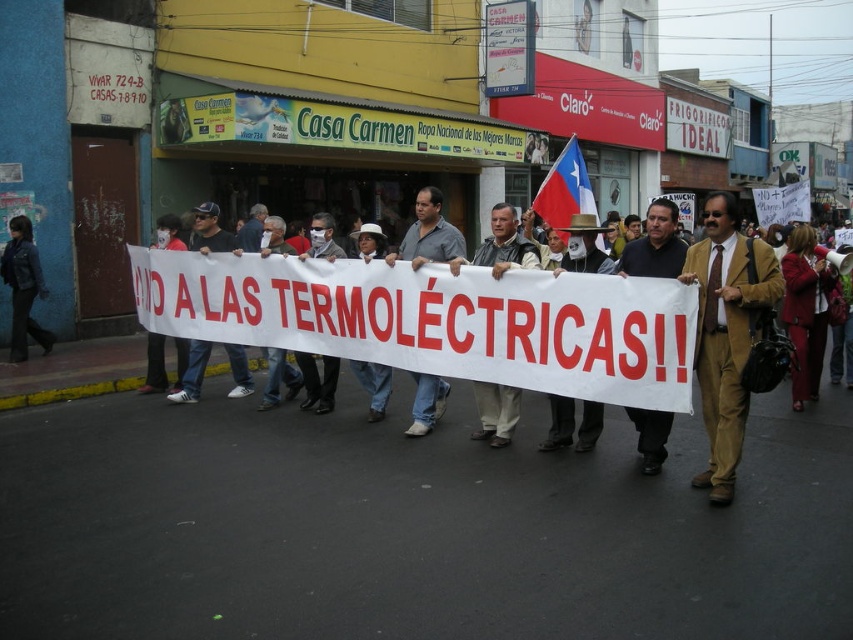
Question: Does khaki cotton pants at center have a smaller size compared to white cotton shirt at center?

Choices:
 (A) no
 (B) yes

Answer: (B)

Question: Estimate the real-world distances between objects in this image. Which object is closer to the brown leather jacket at center?

Choices:
 (A) dark blue leather jacket at left
 (B) dark brown suit at center
 (C) blue and white fabric flag at center

Answer: (B)

Question: Which of the following is the closest to the observer?

Choices:
 (A) (648, 420)
 (B) (320, 227)

Answer: (A)

Question: Does dark brown suit at center appear under gray cotton shirt at center?

Choices:
 (A) no
 (B) yes

Answer: (B)

Question: In this image, where is brown leather jacket at center located relative to blue and white fabric flag at center?

Choices:
 (A) left
 (B) right

Answer: (A)

Question: Which object is farther from the camera taking this photo?

Choices:
 (A) blue and white fabric flag at center
 (B) dark brown suit at center
 (C) dark blue leather jacket at left

Answer: (C)